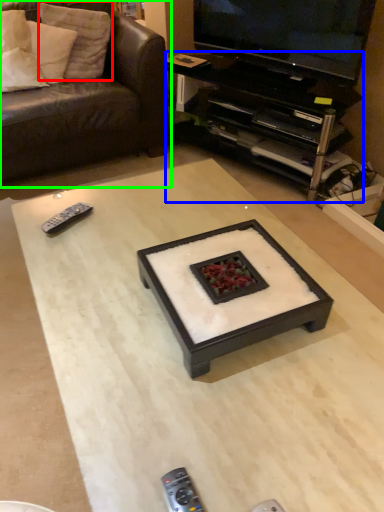
Question: Considering the real-world distances, which object is farthest from pillow (highlighted by a red box)? desk (highlighted by a blue box) or studio couch (highlighted by a green box)?

Choices:
 (A) desk
 (B) studio couch

Answer: (A)